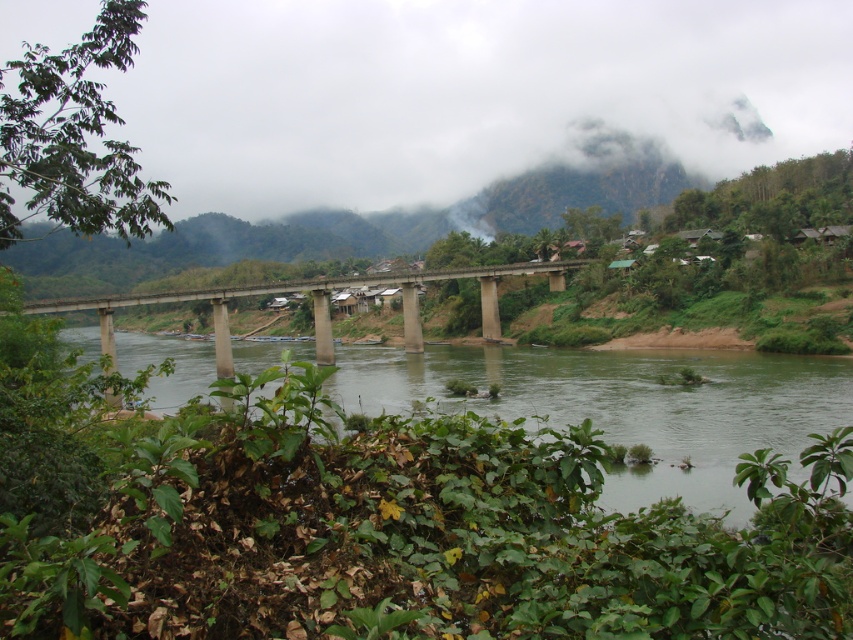
Is point (114, 134) more distant than point (843, 358)?

Yes, point (114, 134) is farther from viewer.

How far apart are white foggy cloud at upper center and green water at center?

white foggy cloud at upper center is 155.20 meters from green water at center.

Which is in front, point (239, 90) or point (416, 397)?

Point (416, 397)

This screenshot has width=853, height=640. I want to click on white foggy cloud at upper center, so click(465, 93).

Is white foggy cloud at upper center shorter than concrete bridge at center?

Incorrect, white foggy cloud at upper center's height does not fall short of concrete bridge at center's.

Where is `white foggy cloud at upper center`? white foggy cloud at upper center is located at coordinates (465, 93).

Find the location of a particular element. The height and width of the screenshot is (640, 853). white foggy cloud at upper center is located at coordinates (465, 93).

From the picture: Can you confirm if green water at center is thinner than concrete bridge at center?

No, green water at center is not thinner than concrete bridge at center.

Between point (498, 380) and point (259, 291), which one is positioned in front?

Point (498, 380) is in front.

Where is `green water at center`? This screenshot has width=853, height=640. green water at center is located at coordinates (625, 404).